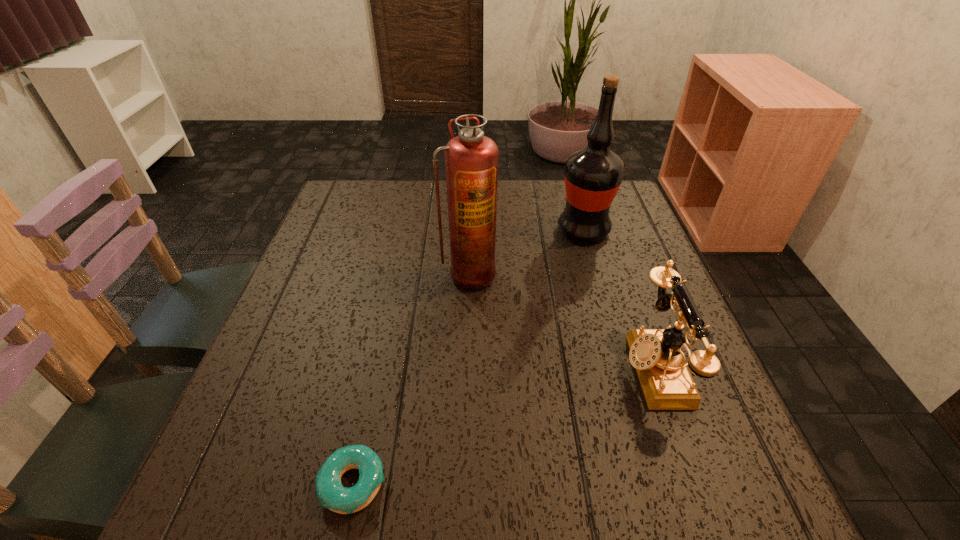
Identify the location of the farthest object. The image size is (960, 540). (593, 175).

Image resolution: width=960 pixels, height=540 pixels. Identify the location of fire extinguisher. (471, 159).

The height and width of the screenshot is (540, 960). Find the location of `the second farthest object`. the second farthest object is located at coordinates (471, 159).

Locate an element on the screen. The width and height of the screenshot is (960, 540). the second shortest object is located at coordinates (x=667, y=384).

Locate an element on the screen. This screenshot has width=960, height=540. the second nearest object is located at coordinates (667, 384).

The width and height of the screenshot is (960, 540). Identify the location of the shortest object. (332, 495).

Where is `doughnut`? The image size is (960, 540). doughnut is located at coordinates (332, 495).

Where is `vacant space located on the front of the wine bottle`? vacant space located on the front of the wine bottle is located at coordinates (624, 369).

Locate an element on the screen. The width and height of the screenshot is (960, 540). vacant space located 0.260m on the side of the third nearest object with the label is located at coordinates (466, 387).

At what (x,y) coordinates should I click in order to perform the action: click on blank space located 0.320m on the dial of the third tallest object. Please return your answer as a coordinate pair (x, y). The width and height of the screenshot is (960, 540). Looking at the image, I should click on (464, 368).